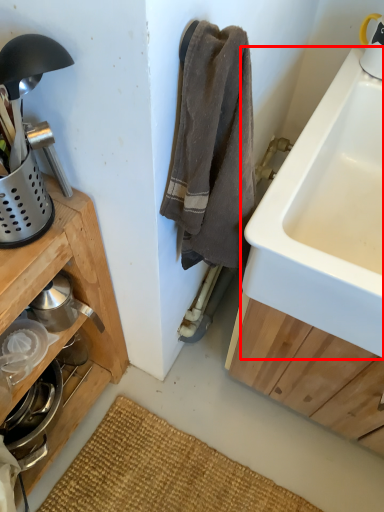
Question: From the image's perspective, what is the correct spatial positioning of sink (annotated by the red box) in reference to appliance?

Choices:
 (A) below
 (B) above

Answer: (B)